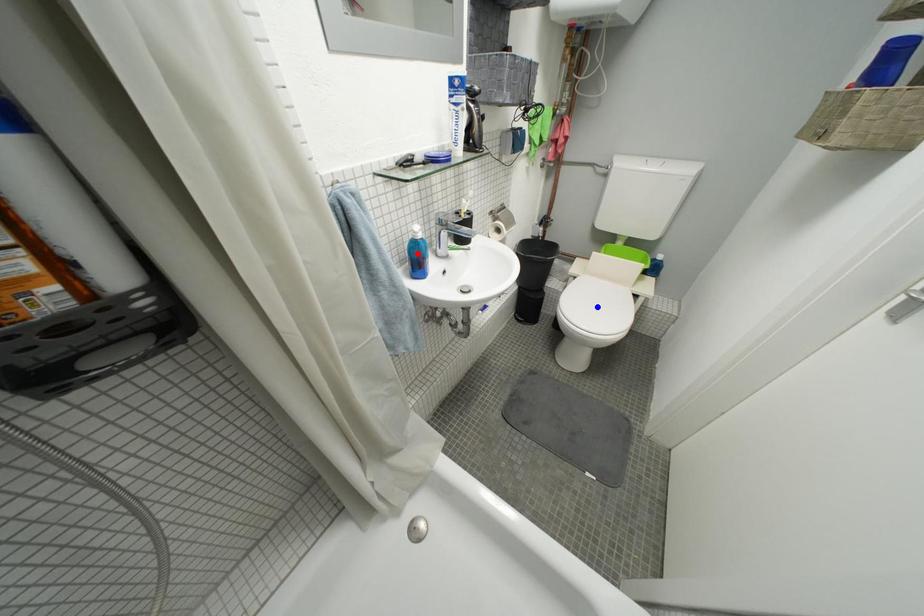
Question: In the image, two points are highlighted. Which point is nearer to the camera? Reply with the corresponding letter.

Choices:
 (A) blue point
 (B) red point

Answer: (B)